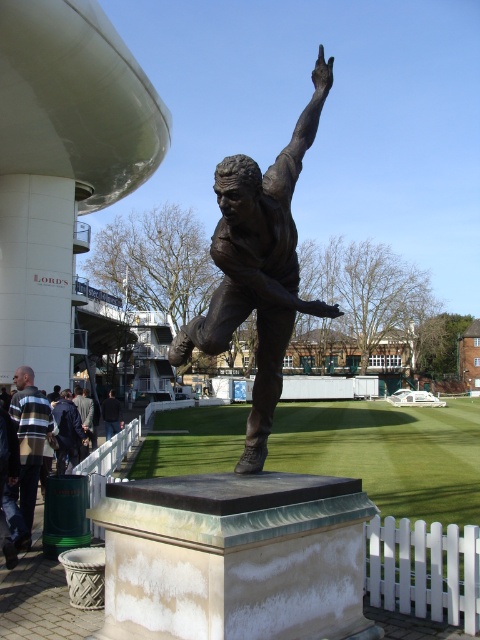
You are a photographer standing in front of the bronze statue of a cricketer. You notice two items on the ground at the lower left corner of your view. Which item is nearer to you between the striped sweater at lower left and the dark blue jacket at lower left?

The striped sweater at lower left is closer to the viewer than the dark blue jacket at lower left, so the striped sweater is nearer to you.

You are standing at the center of the cricket ground and see the bronze statue of a cricketer and the dark blue jacket at lower left. According to the coordinates provided, which object is closer to the bottom edge of the image?

The dark blue jacket at lower left is closer to the bottom edge of the image because its y coordinate is 0.142, which is lower than the bronze statue of a cricketer.

You are a photographer planning to take a photo of the bronze statue at center and the dark brown leather jacket at lower left. You want to ensure both subjects are in focus. Given that the statue is much taller than the jacket, which object should you position closer to the camera to maintain focus on both?

The bronze statue at center is much taller than the dark brown leather jacket at lower left. To keep both in focus, position the dark brown leather jacket at lower left closer to the camera since it is smaller and the statue is taller, balancing their sizes in the frame.